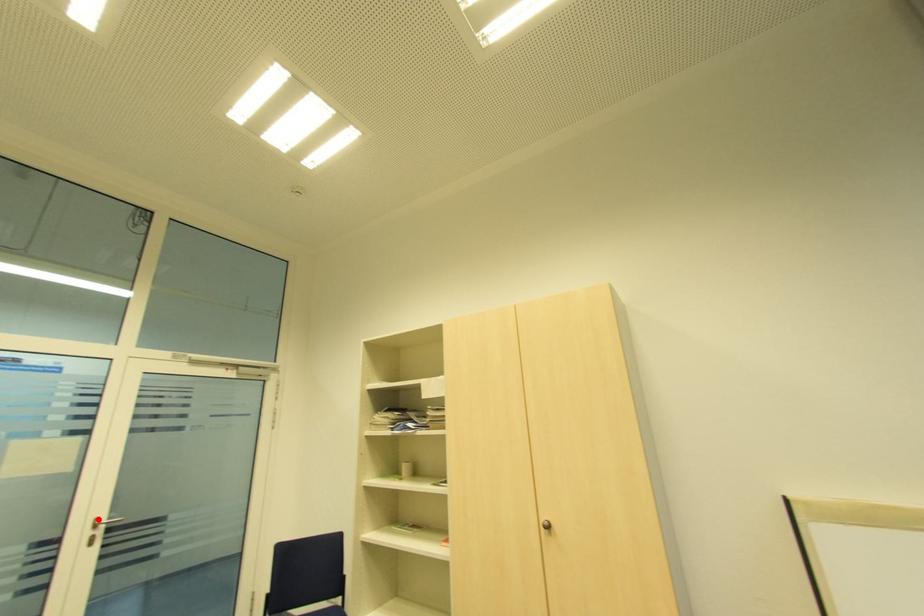
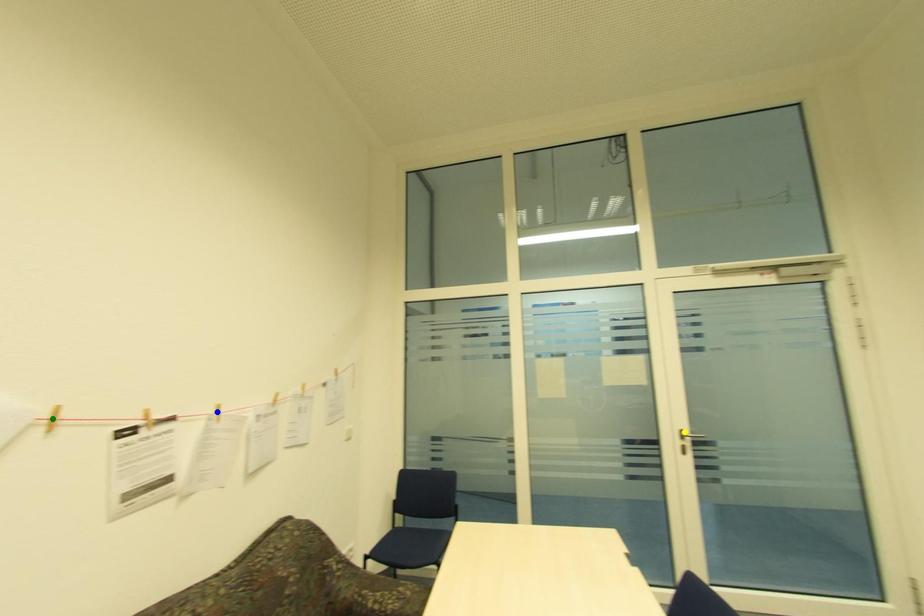
Question: I am providing you with two images of the same scene from different viewpoints. A red point is marked on the first image. You are given multiple points on the second image. Which mark in image 2 goes with the point in image 1?

Choices:
 (A) blue point
 (B) yellow point
 (C) green point

Answer: (B)